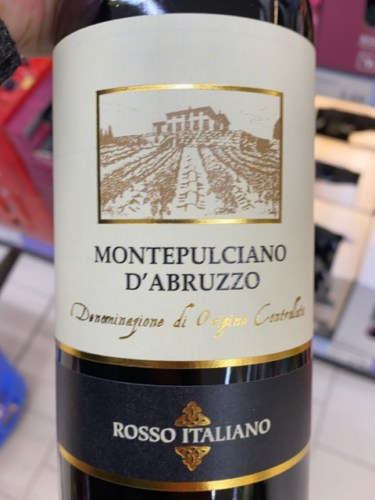
The width and height of the screenshot is (375, 500). What are the coordinates of `bottle` in the screenshot? It's located at (262, 369).